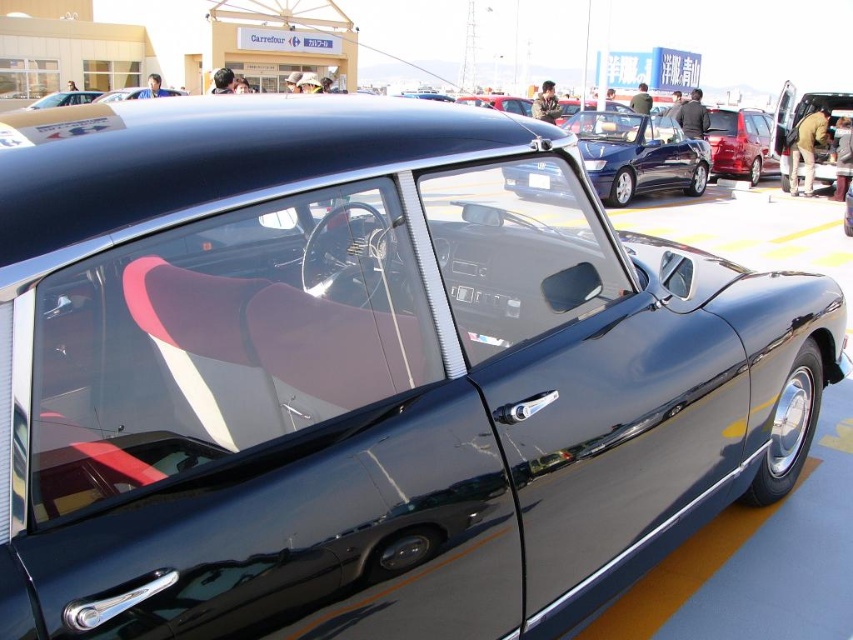
Question: Which point is farther to the camera?

Choices:
 (A) matte black car at upper left
 (B) glossy black sedan at center
 (C) black plastic license plate at center

Answer: (A)

Question: Can you confirm if glossy black sedan at center is positioned to the right of black plastic license plate at center?

Choices:
 (A) no
 (B) yes

Answer: (B)

Question: Does glossy black sedan at center come behind black plastic license plate at center?

Choices:
 (A) yes
 (B) no

Answer: (B)

Question: Which of the following is the closest to the observer?

Choices:
 (A) matte black car at upper left
 (B) glossy black sedan at center
 (C) black plastic license plate at center

Answer: (B)

Question: Which of the following is the closest to the observer?

Choices:
 (A) glossy black sedan at center
 (B) matte black car at upper left

Answer: (A)

Question: Can you confirm if matte black car at upper left is positioned above black plastic license plate at center?

Choices:
 (A) yes
 (B) no

Answer: (A)